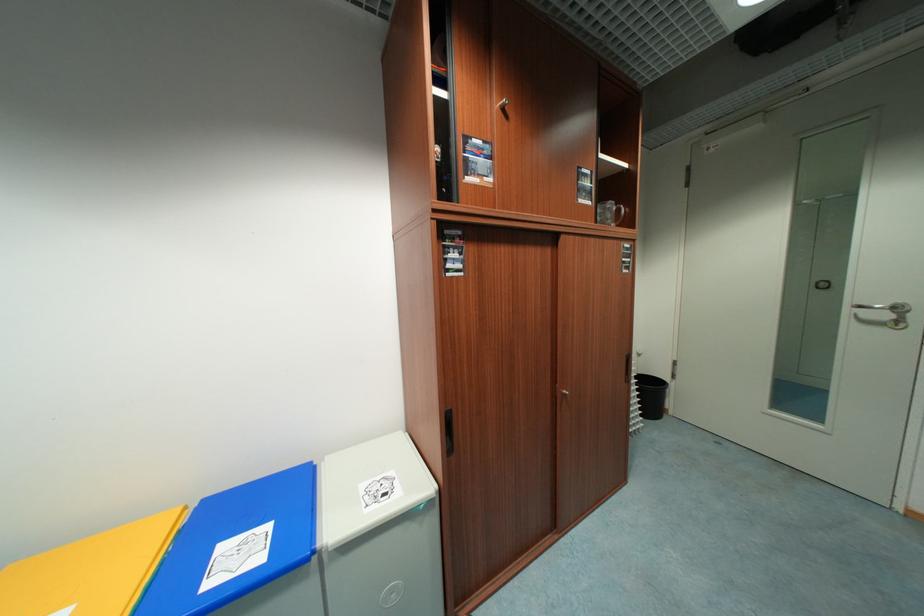
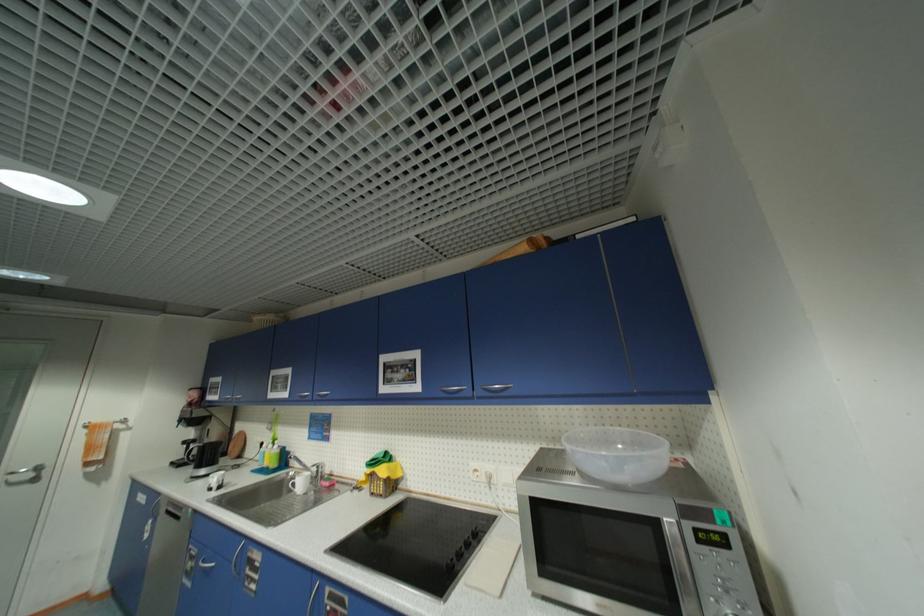
Locate, in the second image, the point that corresponds to point 853,312 in the first image.

(7, 479)